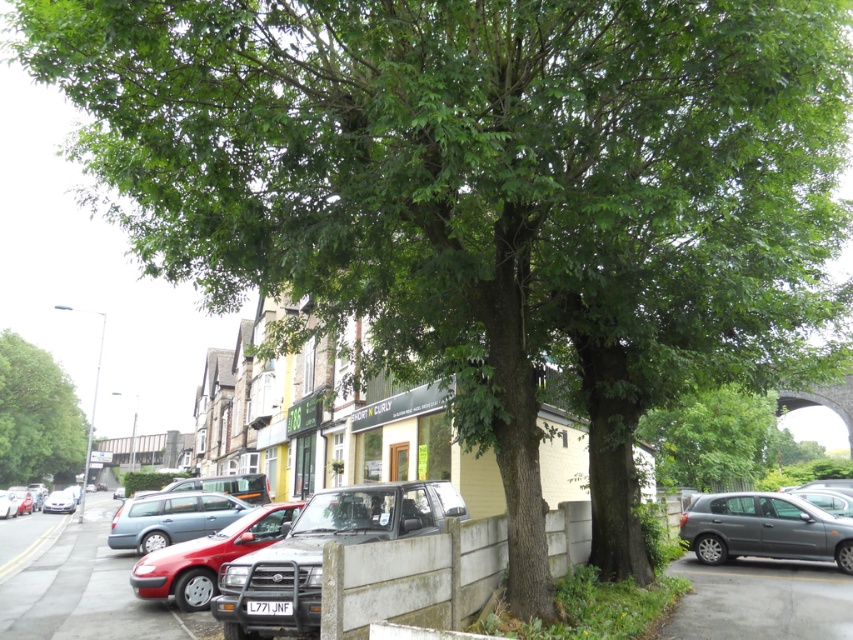
Is smooth asphalt pavement at lower left in front of green leafy tree at center?

Yes, smooth asphalt pavement at lower left is in front of green leafy tree at center.

Identify the location of smooth asphalt pavement at lower left. (82, 589).

Where is `smooth asphalt pavement at lower left`? smooth asphalt pavement at lower left is located at coordinates (82, 589).

Can you confirm if matte black suv at center is thinner than metallic gray sedan at right?

In fact, matte black suv at center might be wider than metallic gray sedan at right.

Which is above, matte black suv at center or metallic gray sedan at right?

matte black suv at center is higher up.

Does point (242, 556) come closer to viewer compared to point (753, 552)?

Yes, point (242, 556) is in front of point (753, 552).

At what (x,y) coordinates should I click in order to perform the action: click on matte black suv at center. Please return your answer as a coordinate pair (x, y). This screenshot has width=853, height=640. Looking at the image, I should click on (321, 554).

Can you confirm if gray asphalt pavement at lower right is bigger than matte red car at center?

No.

Is point (682, 564) positioned in front of point (167, 580)?

No.

Is point (799, 577) farther from viewer compared to point (225, 556)?

Yes, it is behind point (225, 556).

I want to click on gray asphalt pavement at lower right, so click(761, 600).